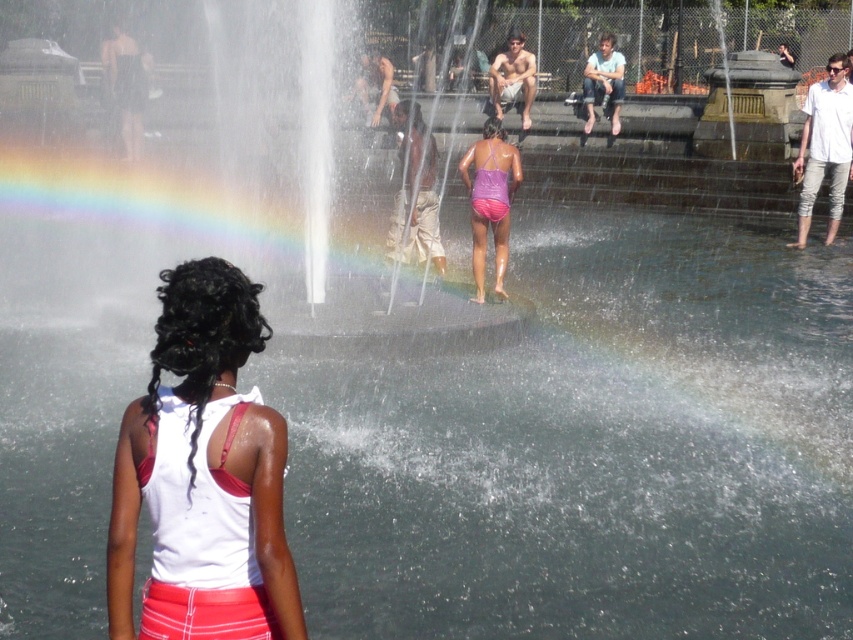
Question: Is white matte tank top at center to the left of purple matte swimsuit at center from the viewer's perspective?

Choices:
 (A) no
 (B) yes

Answer: (B)

Question: Can you confirm if white matte tank top at center is bigger than purple matte swimsuit at center?

Choices:
 (A) no
 (B) yes

Answer: (A)

Question: Is white matte tank top at center further to camera compared to purple matte swimsuit at center?

Choices:
 (A) yes
 (B) no

Answer: (B)

Question: Which point appears closest to the camera in this image?

Choices:
 (A) (138, 481)
 (B) (494, 196)

Answer: (A)